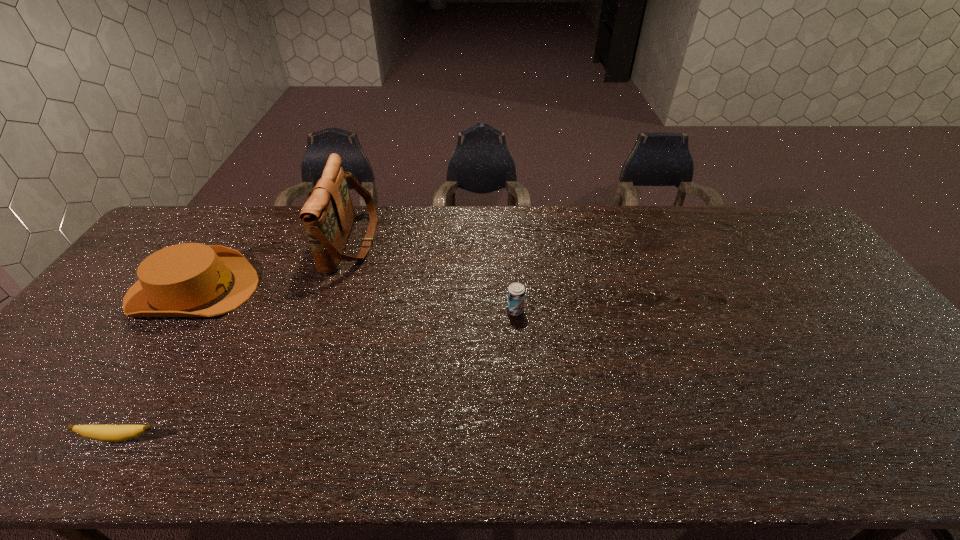
The height and width of the screenshot is (540, 960). What are the coordinates of `the third object from left to right` in the screenshot? It's located at (328, 215).

This screenshot has width=960, height=540. In order to click on shoulder bag in this screenshot , I will do `click(328, 215)`.

You are a GUI agent. You are given a task and a screenshot of the screen. Output one action in this format:
    pyautogui.click(x=<x>, y=<y>)
    Task: Click on the cowboy hat
    Image resolution: width=960 pixels, height=540 pixels.
    Given the screenshot: What is the action you would take?
    pyautogui.click(x=190, y=279)

You are a GUI agent. You are given a task and a screenshot of the screen. Output one action in this format:
    pyautogui.click(x=<x>, y=<y>)
    Task: Click on the rightmost object
    The height and width of the screenshot is (540, 960).
    Given the screenshot: What is the action you would take?
    pyautogui.click(x=516, y=291)

Find the location of `the nearest object`. the nearest object is located at coordinates (108, 433).

At what (x,y) coordinates should I click in order to perform the action: click on the shortest object. Please return your answer as a coordinate pair (x, y). This screenshot has width=960, height=540. Looking at the image, I should click on (108, 433).

Identify the location of vacant area situated 0.270m on the front-facing side of the tallest object. (455, 242).

This screenshot has height=540, width=960. I want to click on vacant space located 0.160m on the front-facing side of the cowboy hat, so (x=310, y=290).

You are a GUI agent. You are given a task and a screenshot of the screen. Output one action in this format:
    pyautogui.click(x=<x>, y=<y>)
    Task: Click on the free region located 0.150m on the front of the beer can
    The image size is (960, 540).
    Given the screenshot: What is the action you would take?
    pyautogui.click(x=519, y=361)

Where is `free space located on the right of the shortest object`? This screenshot has width=960, height=540. free space located on the right of the shortest object is located at coordinates (342, 437).